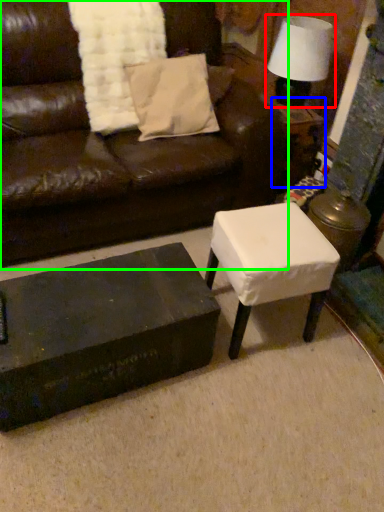
Question: Which is farther away from table lamp (highlighted by a red box)? side table (highlighted by a blue box) or studio couch (highlighted by a green box)?

Choices:
 (A) side table
 (B) studio couch

Answer: (B)